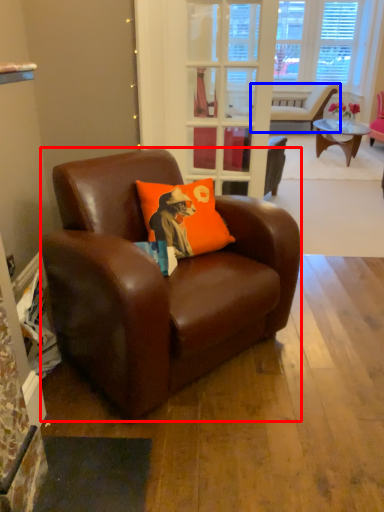
Question: Which object is further to the camera taking this photo, chair (highlighted by a red box) or chair (highlighted by a blue box)?

Choices:
 (A) chair
 (B) chair

Answer: (B)